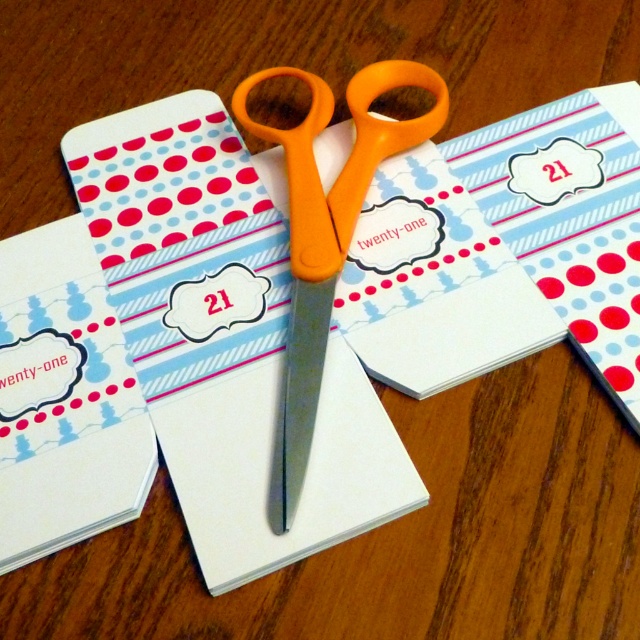
Which is below, matte paper envelope at center or matte white envelope at center?

Positioned lower is matte white envelope at center.

Can you confirm if matte paper envelope at center is positioned above matte white envelope at center?

Correct, matte paper envelope at center is located above matte white envelope at center.

The image size is (640, 640). I want to click on matte paper envelope at center, so click(x=276, y=467).

Does matte white envelope at center come behind orange plastic scissors at center?

No, matte white envelope at center is in front of orange plastic scissors at center.

Measure the distance between matte white envelope at center and orange plastic scissors at center.

They are 15.22 inches apart.

Find the location of a particular element. This screenshot has width=640, height=640. matte white envelope at center is located at coordinates (65, 400).

Is point (97, 211) in front of point (292, 392)?

No.

Is matte paper envelope at center to the right of orange plastic scissors at center from the viewer's perspective?

No, matte paper envelope at center is not to the right of orange plastic scissors at center.

Is point (84, 189) positioned after point (317, 365)?

Yes, it is.

This screenshot has width=640, height=640. Find the location of `matte paper envelope at center`. matte paper envelope at center is located at coordinates (276, 467).